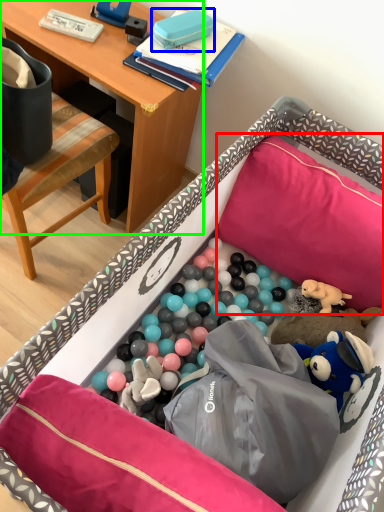
Question: Which is farther away from pillow (highlighted by a red box)? toy (highlighted by a blue box) or desk (highlighted by a green box)?

Choices:
 (A) toy
 (B) desk

Answer: (A)